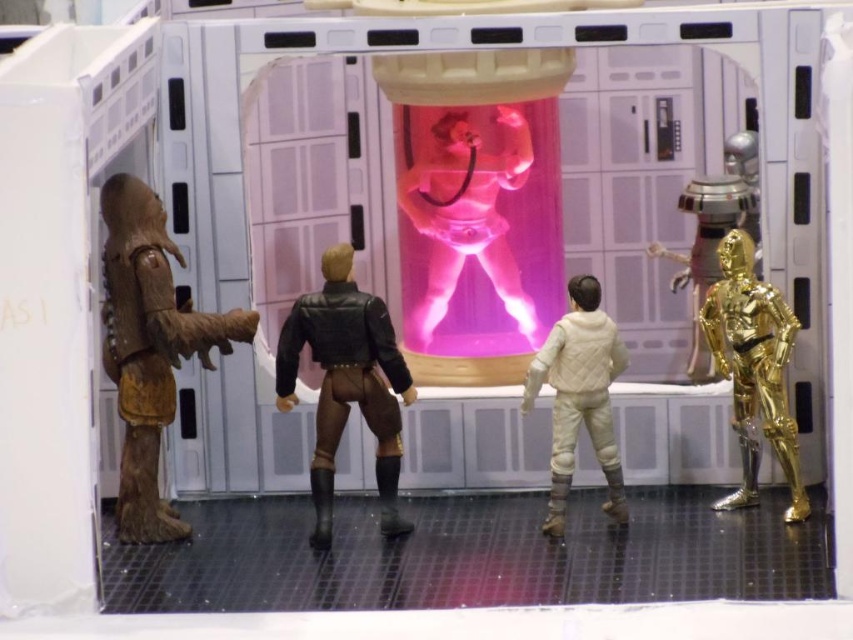
Question: Considering the real-world distances, which object is farthest from the pink translucent figure at center?

Choices:
 (A) gold metallic robot at right
 (B) leather jacket at center

Answer: (A)

Question: Does leather jacket at center come in front of white quilted jacket at center?

Choices:
 (A) yes
 (B) no

Answer: (B)

Question: Does leather jacket at center appear on the right side of gold metallic robot at right?

Choices:
 (A) no
 (B) yes

Answer: (A)

Question: Based on their relative distances, which object is farther from the brown furry creature at left?

Choices:
 (A) gold metallic robot at right
 (B) pink translucent figure at center
 (C) white quilted jacket at center
 (D) leather jacket at center

Answer: (A)

Question: Estimate the real-world distances between objects in this image. Which object is closer to the pink translucent figure at center?

Choices:
 (A) leather jacket at center
 (B) gold metallic robot at right
 (C) brown furry creature at left

Answer: (A)

Question: Is brown furry creature at left further to camera compared to leather jacket at center?

Choices:
 (A) yes
 (B) no

Answer: (B)